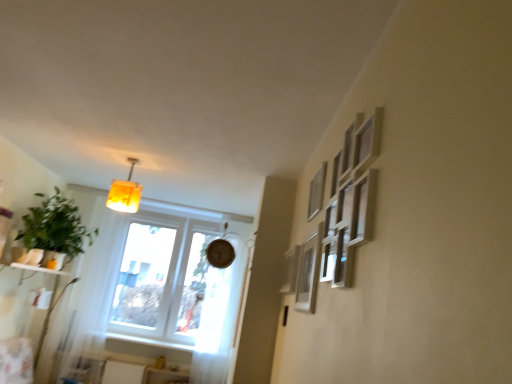
Question: From the image's perspective, is white painted wood at lower left beneath green matte plant at left?

Choices:
 (A) no
 (B) yes

Answer: (B)

Question: Is white painted wood at lower left in front of green matte plant at left?

Choices:
 (A) no
 (B) yes

Answer: (A)

Question: Is white painted wood at lower left outside green matte plant at left?

Choices:
 (A) no
 (B) yes

Answer: (B)

Question: Does white painted wood at lower left appear on the left side of green matte plant at left?

Choices:
 (A) yes
 (B) no

Answer: (B)

Question: Is white painted wood at lower left positioned with its back to green matte plant at left?

Choices:
 (A) no
 (B) yes

Answer: (A)

Question: From a real-world perspective, does white painted wood at lower left stand above green matte plant at left?

Choices:
 (A) no
 (B) yes

Answer: (A)

Question: Is green matte plant at left next to white sheer curtain at center and touching it?

Choices:
 (A) yes
 (B) no

Answer: (B)

Question: Considering the relative sizes of green matte plant at left and white sheer curtain at center in the image provided, is green matte plant at left wider than white sheer curtain at center?

Choices:
 (A) yes
 (B) no

Answer: (A)

Question: Can you confirm if green matte plant at left is positioned to the right of white sheer curtain at center?

Choices:
 (A) no
 (B) yes

Answer: (A)

Question: From a real-world perspective, is green matte plant at left over white sheer curtain at center?

Choices:
 (A) no
 (B) yes

Answer: (B)

Question: Is the depth of green matte plant at left less than that of white sheer curtain at center?

Choices:
 (A) yes
 (B) no

Answer: (A)

Question: Is green matte plant at left facing towards white sheer curtain at center?

Choices:
 (A) no
 (B) yes

Answer: (A)

Question: From the image's perspective, would you say white painted wood at lower left is positioned over matte silver picture frame at right, arranged as the 3th picture frame when viewed from the back?

Choices:
 (A) no
 (B) yes

Answer: (A)